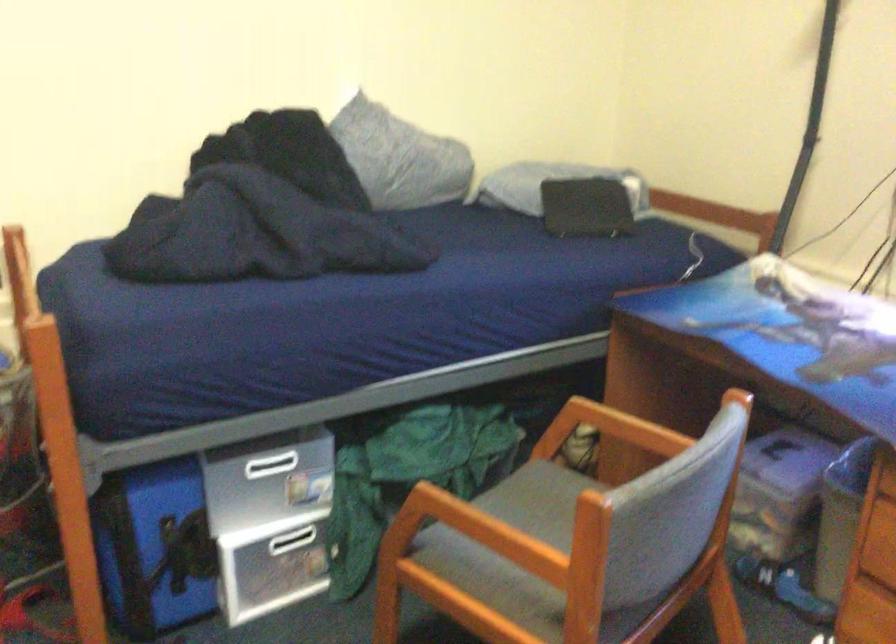
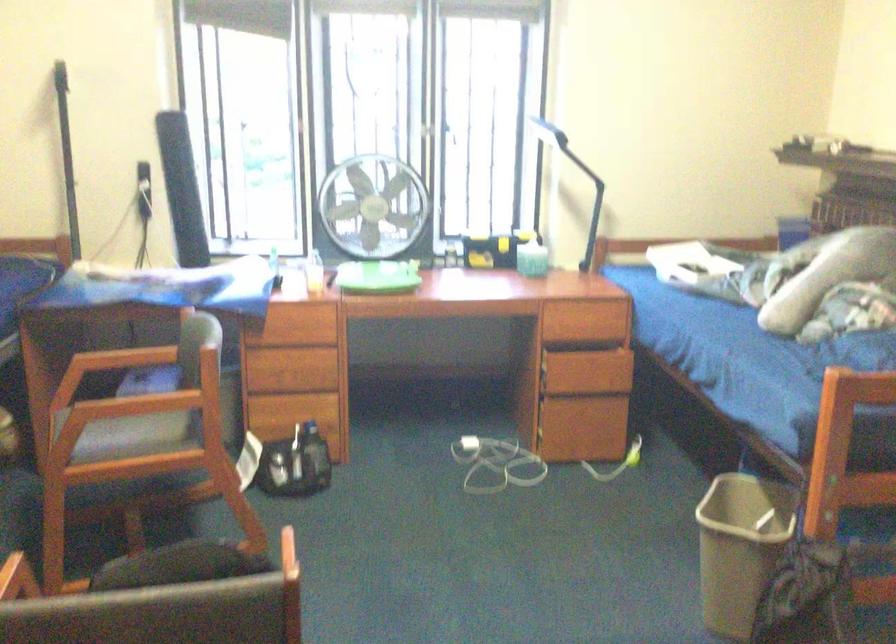
Locate, in the second image, the point that corresponds to [633,440] in the first image.

(128, 357)